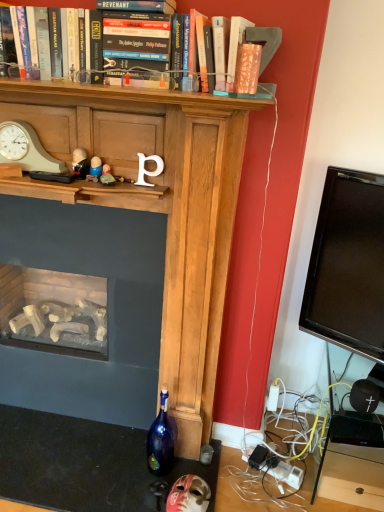
Question: Considering the relative positions of matte black figurine at center, positioned as the fourth toy in right-to-left order, and hardcover book at upper center in the image provided, is matte black figurine at center, positioned as the fourth toy in right-to-left order, to the right of hardcover book at upper center from the viewer's perspective?

Choices:
 (A) yes
 (B) no

Answer: (B)

Question: Is matte black figurine at center, the 1th toy from the left, not close to hardcover book at upper center?

Choices:
 (A) no
 (B) yes

Answer: (A)

Question: Can you confirm if matte black figurine at center, placed as the 4th toy when sorted from bottom to top, is smaller than hardcover book at upper center?

Choices:
 (A) no
 (B) yes

Answer: (B)

Question: Is matte black figurine at center, placed as the 4th toy when sorted from bottom to top, directly adjacent to hardcover book at upper center?

Choices:
 (A) no
 (B) yes

Answer: (A)

Question: From the image's perspective, would you say matte black figurine at center, positioned as the fourth toy in right-to-left order, is positioned over hardcover book at upper center?

Choices:
 (A) no
 (B) yes

Answer: (A)

Question: Is matte black figurine at center, the 2th toy in the front-to-back sequence, at the left side of hardcover book at upper center?

Choices:
 (A) yes
 (B) no

Answer: (A)

Question: Is hardcover book at upper center outside of matte beige clock at left?

Choices:
 (A) no
 (B) yes

Answer: (B)

Question: Is hardcover book at upper center oriented towards matte beige clock at left?

Choices:
 (A) yes
 (B) no

Answer: (B)

Question: Is hardcover book at upper center to the right of matte beige clock at left from the viewer's perspective?

Choices:
 (A) no
 (B) yes

Answer: (B)

Question: From the image's perspective, would you say hardcover book at upper center is shown under matte beige clock at left?

Choices:
 (A) yes
 (B) no

Answer: (B)

Question: Considering the relative positions of hardcover book at upper center and matte beige clock at left in the image provided, is hardcover book at upper center in front of matte beige clock at left?

Choices:
 (A) yes
 (B) no

Answer: (A)

Question: Considering the relative sizes of hardcover book at upper center and matte beige clock at left in the image provided, is hardcover book at upper center thinner than matte beige clock at left?

Choices:
 (A) yes
 (B) no

Answer: (B)

Question: From a real-world perspective, is blue glass bottle at lower center physically above matte stone figurine at center, acting as the 2th toy starting from the right?

Choices:
 (A) no
 (B) yes

Answer: (A)